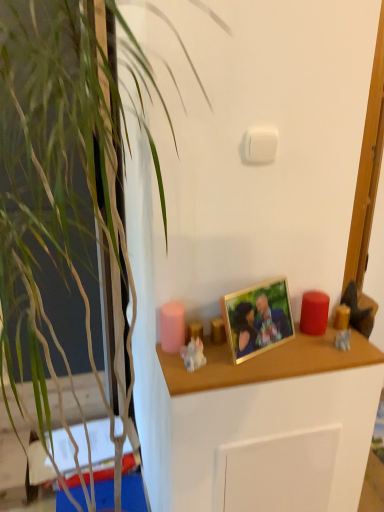
Locate an element on the screen. Image resolution: width=384 pixels, height=512 pixels. vacant area on top of wooden shelf at center (from a real-world perspective) is located at coordinates (282, 348).